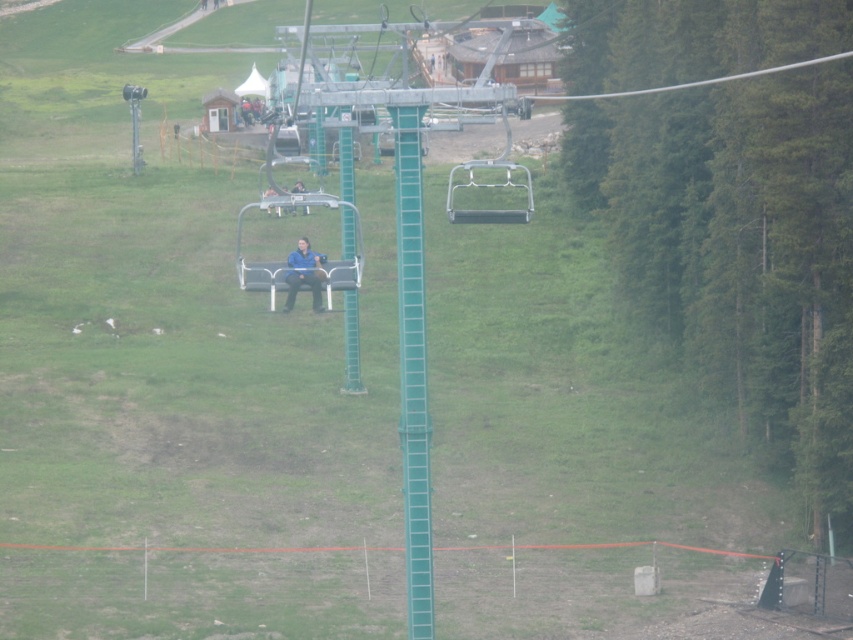
Question: Which object appears farthest from the camera in this image?

Choices:
 (A) green plastic chair at center
 (B) blue fabric jacket at center

Answer: (A)

Question: Can you confirm if green plastic chair at center is positioned to the right of blue fabric jacket at center?

Choices:
 (A) yes
 (B) no

Answer: (A)

Question: Does green plastic chair at center appear over blue fabric jacket at center?

Choices:
 (A) no
 (B) yes

Answer: (B)

Question: Which point is farther to the camera?

Choices:
 (A) (311, 269)
 (B) (489, 220)

Answer: (B)

Question: Can you confirm if green plastic chair at center is smaller than blue fabric jacket at center?

Choices:
 (A) no
 (B) yes

Answer: (A)